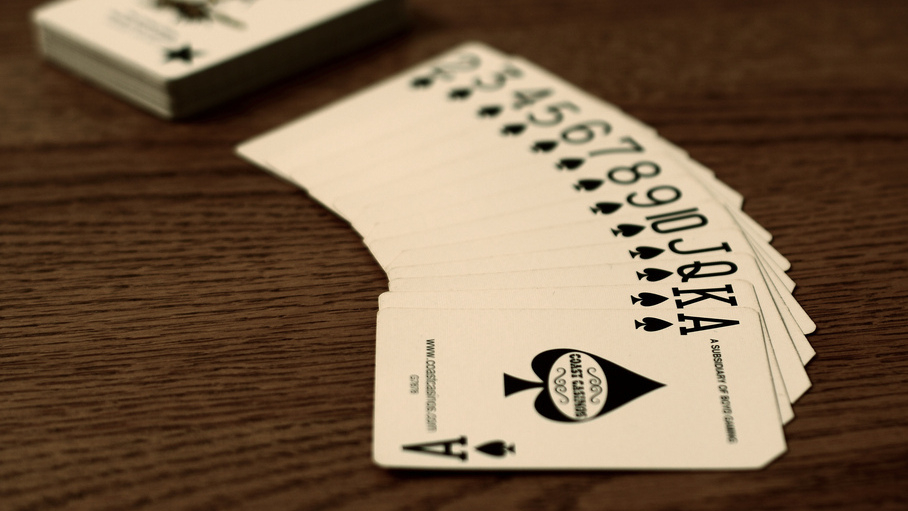
I want to click on wooden surface, so click(135, 322), click(764, 51), click(865, 430).